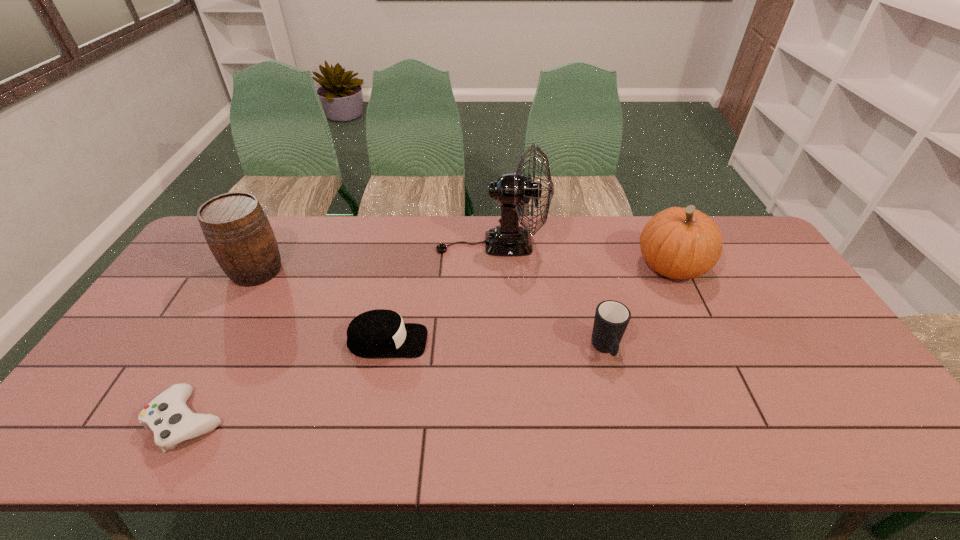
I want to click on the tallest object, so click(513, 190).

You are a GUI agent. You are given a task and a screenshot of the screen. Output one action in this format:
    pyautogui.click(x=<x>, y=<y>)
    Task: Click on the rightmost object
    The image size is (960, 540).
    Given the screenshot: What is the action you would take?
    pyautogui.click(x=679, y=243)

This screenshot has width=960, height=540. In order to click on cider in this screenshot , I will do `click(236, 228)`.

The height and width of the screenshot is (540, 960). I want to click on mug, so click(x=611, y=319).

You are a GUI agent. You are given a task and a screenshot of the screen. Output one action in this format:
    pyautogui.click(x=<x>, y=<y>)
    Task: Click on the fifth object from left to right
    The height and width of the screenshot is (540, 960).
    Given the screenshot: What is the action you would take?
    pyautogui.click(x=611, y=319)

Where is `the fifth tallest object`? This screenshot has height=540, width=960. the fifth tallest object is located at coordinates (380, 333).

Image resolution: width=960 pixels, height=540 pixels. I want to click on control, so click(167, 415).

Identify the location of the nearest object. The height and width of the screenshot is (540, 960). (167, 415).

This screenshot has height=540, width=960. Identify the location of vacant area situated 0.340m in front of the tallest object, indicating the direction of air flow. (338, 244).

This screenshot has width=960, height=540. Identify the location of free space located in front of the tallest object, indicating the direction of air flow. point(376,244).